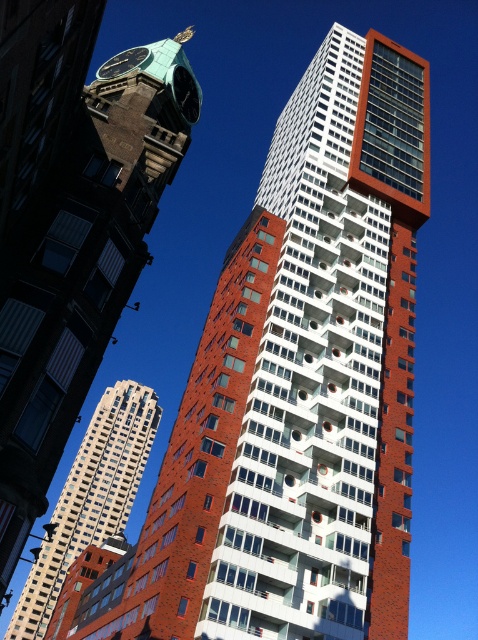
Question: Which of these objects is positioned closest to the matte white tower at center?

Choices:
 (A) green patina clock tower at upper left
 (B) green glass clock at upper left

Answer: (B)

Question: Which object is closer to the camera taking this photo?

Choices:
 (A) green patina clock tower at upper left
 (B) green polished stone clock at upper left
 (C) matte white tower at center

Answer: (A)

Question: Among these objects, which one is farthest from the camera?

Choices:
 (A) matte white tower at center
 (B) brick textured building at center

Answer: (A)

Question: Where is green patina clock tower at upper left located in relation to green glass clock at upper left in the image?

Choices:
 (A) below
 (B) above

Answer: (A)

Question: Is brick textured building at center behind matte white tower at center?

Choices:
 (A) no
 (B) yes

Answer: (A)

Question: Does green patina clock tower at upper left appear on the left side of green glass clock at upper left?

Choices:
 (A) yes
 (B) no

Answer: (B)